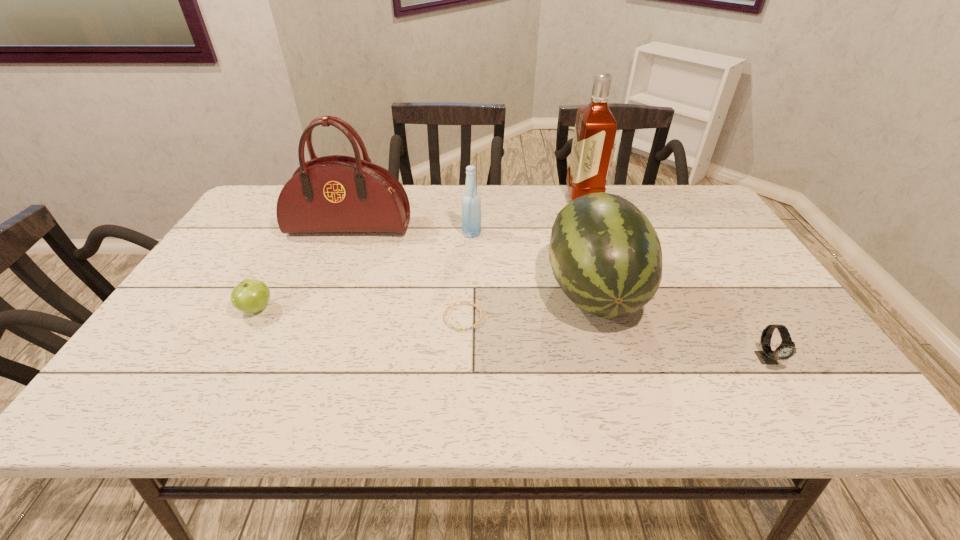
Find the location of a particular element. Image resolution: width=960 pixels, height=540 pixels. free space in the image that satisfies the following two spatial constraints: 1. on the front label of the farthest object; 2. on the surface of the shortest object showing star-shaped elements is located at coordinates (622, 318).

At what (x,y) coordinates should I click in order to perform the action: click on free space that satisfies the following two spatial constraints: 1. on the front-facing side of the sixth shortest object; 2. on the right side of the watermelon. Please return your answer as a coordinate pair (x, y). Looking at the image, I should click on (324, 291).